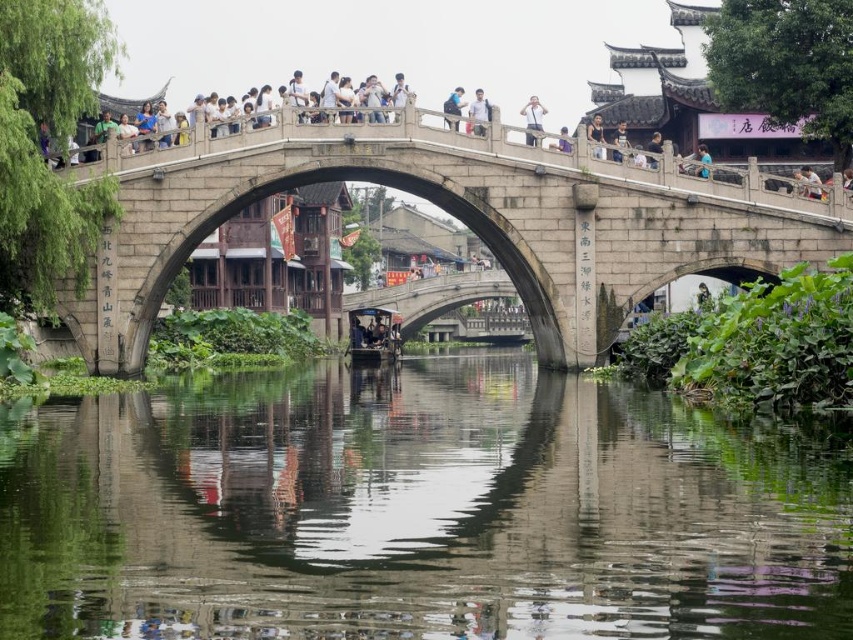
Question: Among these objects, which one is farthest from the camera?

Choices:
 (A) light blue fabric at center
 (B) matte gray stone bridge at center

Answer: (A)

Question: Is wooden boat at center below matte gray stone bridge at center?

Choices:
 (A) no
 (B) yes

Answer: (B)

Question: Which of the following is the farthest from the observer?

Choices:
 (A) light blue fabric shirt at center
 (B) dark blue fabric at center
 (C) light blue fabric shirt at upper center
 (D) transparent water at center

Answer: (B)

Question: Among these objects, which one is nearest to the camera?

Choices:
 (A) matte gray stone bridge at upper center
 (B) light blue fabric shirt at center
 (C) white cotton shirt at upper center

Answer: (B)

Question: Is matte gray stone bridge at upper center smaller than light blue fabric at center?

Choices:
 (A) no
 (B) yes

Answer: (A)

Question: Where is wooden boat at center located in relation to dark blue shirt at upper center in the image?

Choices:
 (A) right
 (B) left

Answer: (B)